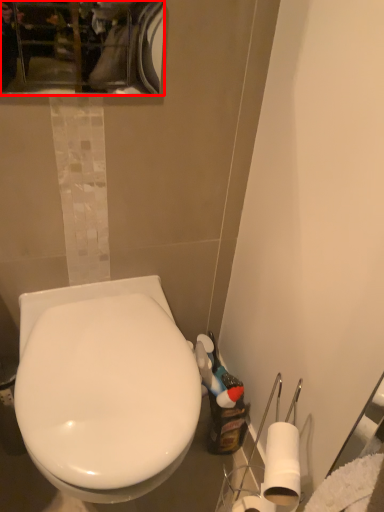
Question: Considering the relative positions of mirror (annotated by the red box) and toilet in the image provided, where is mirror (annotated by the red box) located with respect to the staircase?

Choices:
 (A) right
 (B) left

Answer: (B)